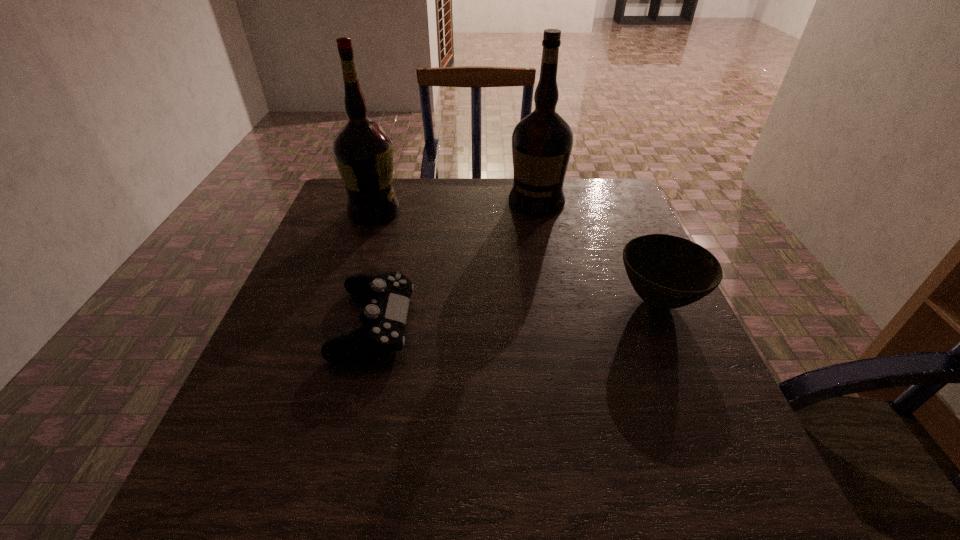
Image resolution: width=960 pixels, height=540 pixels. In the image, there is a desktop. Find the location of `vacant space at the left edge`. vacant space at the left edge is located at coordinates (374, 230).

In the image, there is a desktop. At what (x,y) coordinates should I click in order to perform the action: click on vacant space at the right edge. Please return your answer as a coordinate pair (x, y). This screenshot has width=960, height=540. Looking at the image, I should click on (590, 230).

Identify the location of free region at the far left corner. The image size is (960, 540). (342, 210).

The image size is (960, 540). In order to click on vacant space at the near right corner in this screenshot , I will do `click(681, 450)`.

Find the location of a particular element. Image resolution: width=960 pixels, height=540 pixels. vacant space in between the third object from left to right and the shortest object is located at coordinates (455, 262).

Locate an element on the screen. The image size is (960, 540). unoccupied position between the shortest object and the alcohol is located at coordinates (374, 268).

Locate an element on the screen. This screenshot has height=540, width=960. vacant space in between the control and the alcohol is located at coordinates (374, 268).

The image size is (960, 540). Find the location of `vacant point located between the alcohol and the bowl`. vacant point located between the alcohol and the bowl is located at coordinates (516, 256).

This screenshot has width=960, height=540. Identify the location of vacant area that lies between the control and the liquor. (455, 262).

Locate an element on the screen. unoccupied position between the alcohol and the second shortest object is located at coordinates (516, 256).